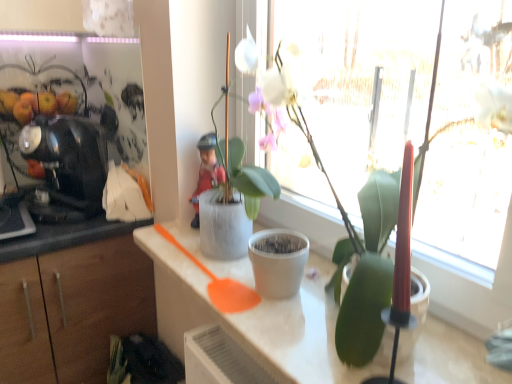
This screenshot has width=512, height=384. What are the coordinates of `free space to the left of matte red figurine at center` in the screenshot? It's located at (165, 227).